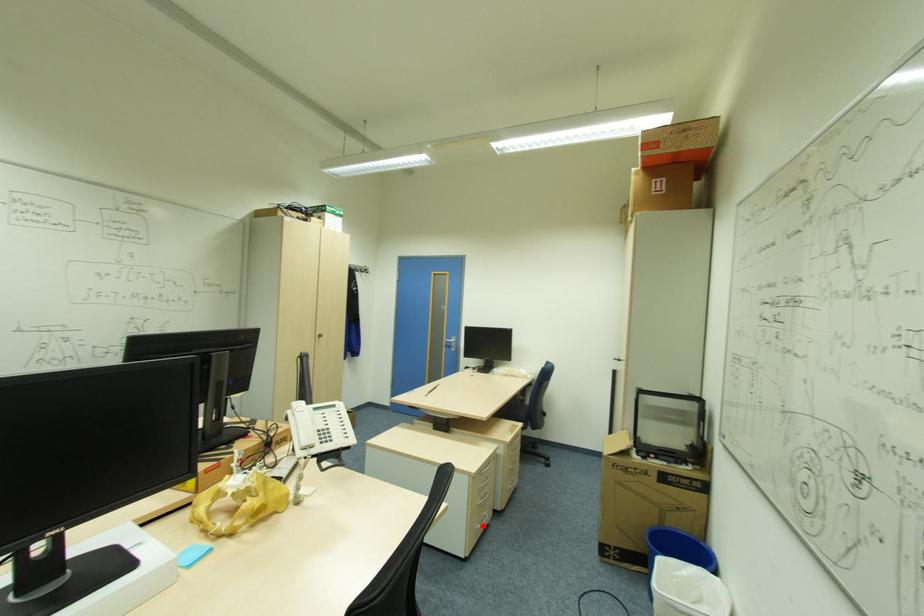
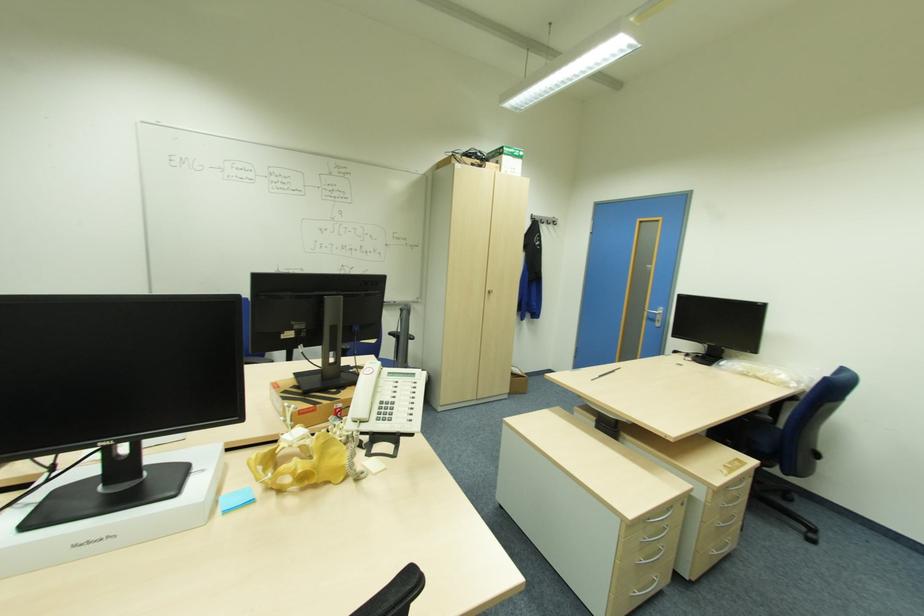
Question: A red point is marked in image1. In image2, is the corresponding 3D point closer to the camera or farther? Reply with the corresponding letter.

Choices:
 (A) The corresponding 3D point is closer.
 (B) The corresponding 3D point is farther.

Answer: (A)